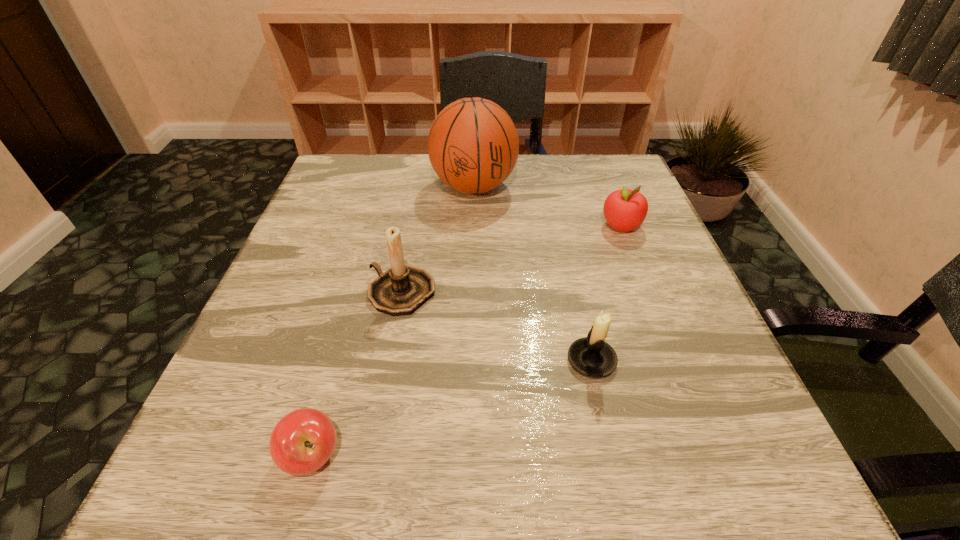
You are a GUI agent. You are given a task and a screenshot of the screen. Output one action in this format:
    pyautogui.click(x=<x>, y=<y>)
    Task: Click on the vacant space that is in between the shortest object and the taller apple
    
    Given the screenshot: What is the action you would take?
    pyautogui.click(x=467, y=341)

Find the location of a particular element. This screenshot has height=540, width=960. free space between the taller candle holder and the nearer apple is located at coordinates (357, 374).

This screenshot has height=540, width=960. Identify the location of free space between the farther apple and the nearest object. (467, 341).

Locate an element on the screen. The width and height of the screenshot is (960, 540). vacant area that lies between the second object from right to left and the farthest object is located at coordinates [533, 274].

Image resolution: width=960 pixels, height=540 pixels. What are the coordinates of `free space between the fourth farthest object and the second farthest object` in the screenshot? It's located at (607, 293).

Locate an element on the screen. the second closest object to the right candle holder is located at coordinates (625, 210).

Image resolution: width=960 pixels, height=540 pixels. In order to click on object that is the fourth closest to the left apple in this screenshot , I will do `click(625, 210)`.

Find the location of a particular element. The width and height of the screenshot is (960, 540). free spot that satisfies the following two spatial constraints: 1. on the front side of the farthest object; 2. on the left side of the right apple is located at coordinates (473, 226).